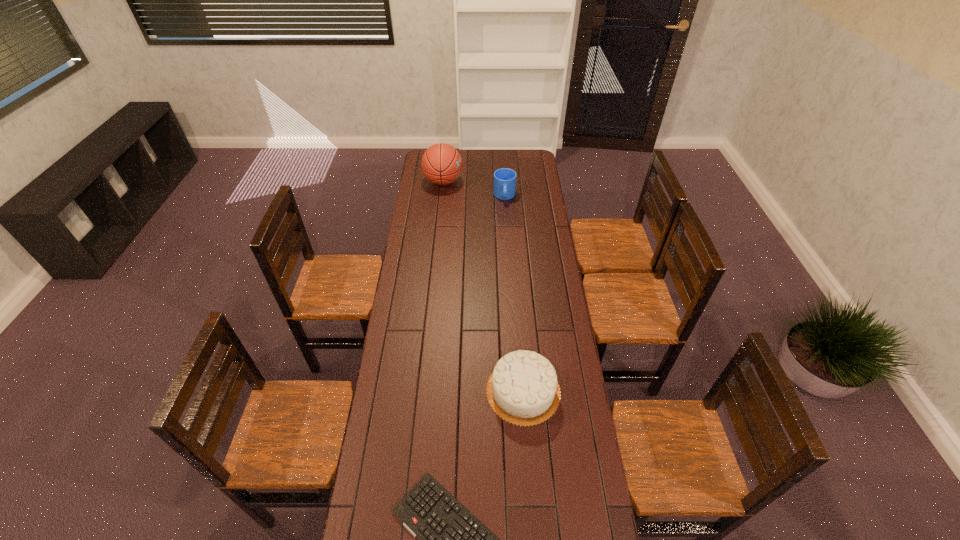
Identify the location of basketball. The height and width of the screenshot is (540, 960). (441, 163).

Locate an element on the screen. This screenshot has height=540, width=960. the third shortest object is located at coordinates (523, 389).

You are a GUI agent. You are given a task and a screenshot of the screen. Output one action in this format:
    pyautogui.click(x=<x>, y=<y>)
    Task: Click on the second nearest object
    This screenshot has height=540, width=960.
    Given the screenshot: What is the action you would take?
    pyautogui.click(x=523, y=389)

The height and width of the screenshot is (540, 960). I want to click on mug, so click(504, 187).

You are a GUI agent. You are given a task and a screenshot of the screen. Output one action in this format:
    pyautogui.click(x=<x>, y=<y>)
    Task: Click on the free spot located on the logo side of the basketball
    The height and width of the screenshot is (540, 960).
    Given the screenshot: What is the action you would take?
    pyautogui.click(x=512, y=181)

You are a GUI agent. You are given a task and a screenshot of the screen. Output one action in this format:
    pyautogui.click(x=<x>, y=<y>)
    Task: Click on the free space located 0.190m on the back of the birthday cake
    The height and width of the screenshot is (540, 960).
    Given the screenshot: What is the action you would take?
    pyautogui.click(x=517, y=321)

Where is `vacant area located 0.340m on the side of the third tallest object with the handle`? This screenshot has width=960, height=540. vacant area located 0.340m on the side of the third tallest object with the handle is located at coordinates (508, 247).

The height and width of the screenshot is (540, 960). Identify the location of object situated at the left edge. (441, 163).

This screenshot has height=540, width=960. Identify the location of object present at the right edge. (523, 389).

At what (x,y) coordinates should I click in order to perform the action: click on vacant space at the far edge of the desktop. Please return your answer as a coordinate pair (x, y). The height and width of the screenshot is (540, 960). Looking at the image, I should click on (495, 151).